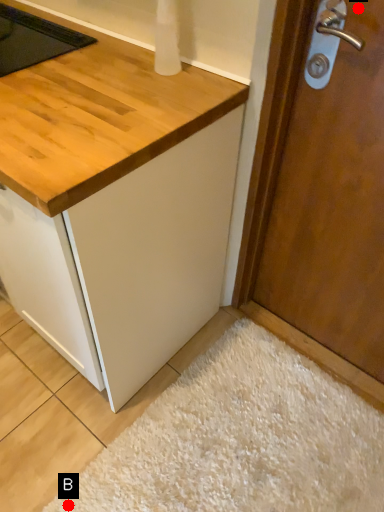
Question: Two points are circled on the image, labeled by A and B beside each circle. Which point is closer to the camera?

Choices:
 (A) A is closer
 (B) B is closer

Answer: (A)